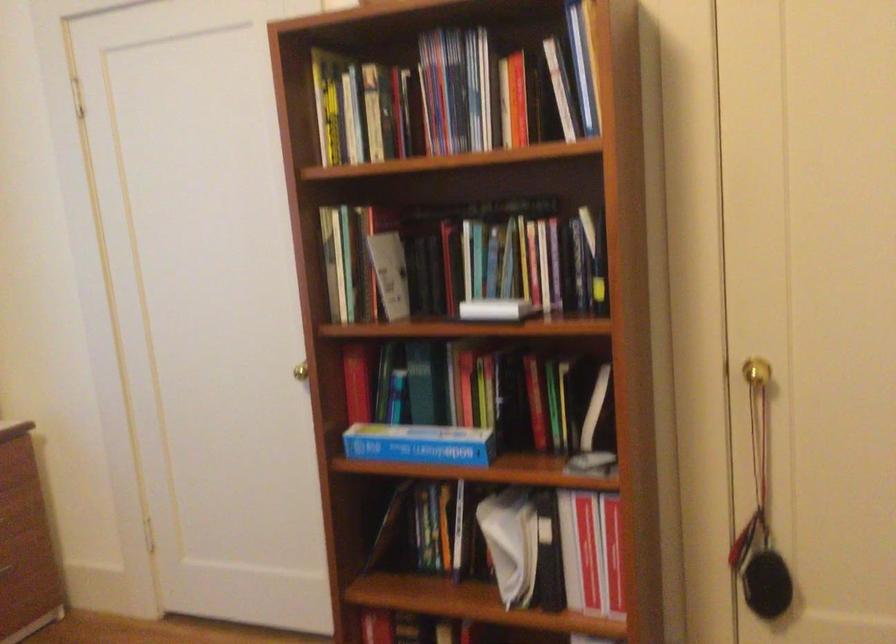
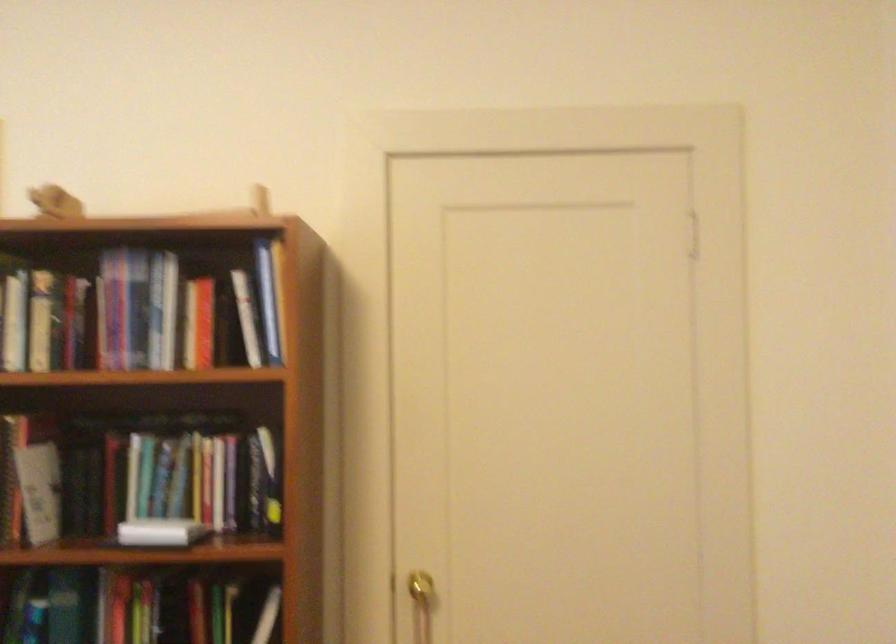
Question: Based on the continuous images, in which direction is the camera rotating? Reply with the corresponding letter.

Choices:
 (A) Left
 (B) Right
 (C) Up
 (D) Down

Answer: (B)